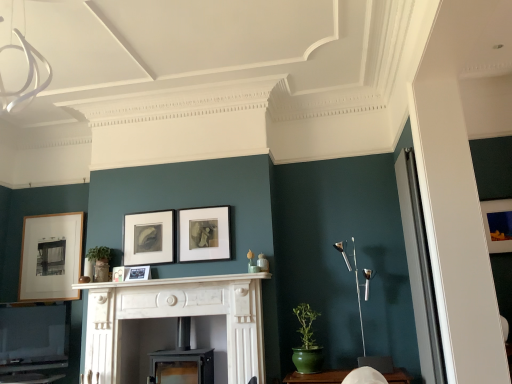
Question: From the image's perspective, would you say matte black picture frame at center, which is counted as the second picture frame, starting from the left, is shown under wooden picture frame at left, the 6th picture frame from the right?

Choices:
 (A) yes
 (B) no

Answer: (A)

Question: Are matte black picture frame at center, which is counted as the second picture frame, starting from the left, and wooden picture frame at left, positioned as the first picture frame in left-to-right order, located far from each other?

Choices:
 (A) yes
 (B) no

Answer: (A)

Question: Is matte black picture frame at center, which is counted as the second picture frame, starting from the left, bigger than wooden picture frame at left, the 6th picture frame from the right?

Choices:
 (A) yes
 (B) no

Answer: (B)

Question: Is matte black picture frame at center, the 5th picture frame viewed from the right, touching wooden picture frame at left, the 6th picture frame from the right?

Choices:
 (A) no
 (B) yes

Answer: (A)

Question: Can you confirm if matte black picture frame at center, which is counted as the second picture frame, starting from the left, is smaller than wooden picture frame at left, the 6th picture frame from the right?

Choices:
 (A) yes
 (B) no

Answer: (A)

Question: From a real-world perspective, relative to wooden picture frame at left, positioned as the first picture frame in left-to-right order, is silver metallic floor lamp at right vertically above or below?

Choices:
 (A) below
 (B) above

Answer: (A)

Question: Considering the positions of silver metallic floor lamp at right and wooden picture frame at left, the 6th picture frame from the right, in the image, is silver metallic floor lamp at right taller or shorter than wooden picture frame at left, the 6th picture frame from the right,?

Choices:
 (A) short
 (B) tall

Answer: (B)

Question: Looking at the image, does silver metallic floor lamp at right seem bigger or smaller compared to wooden picture frame at left, positioned as the first picture frame in left-to-right order?

Choices:
 (A) big
 (B) small

Answer: (A)

Question: From the image's perspective, is silver metallic floor lamp at right positioned above or below wooden picture frame at left, the 6th picture frame from the right?

Choices:
 (A) above
 (B) below

Answer: (B)

Question: Looking at their shapes, would you say black matte picture frame at center, the fifth picture frame when ordered from left to right, is wider or thinner than silver metallic floor lamp at right?

Choices:
 (A) wide
 (B) thin

Answer: (B)

Question: Do you think black matte picture frame at center, placed as the 2th picture frame when sorted from right to left, is within silver metallic floor lamp at right, or outside of it?

Choices:
 (A) outside
 (B) inside

Answer: (A)

Question: Considering their positions, is black matte picture frame at center, placed as the 2th picture frame when sorted from right to left, located in front of or behind silver metallic floor lamp at right?

Choices:
 (A) front
 (B) behind

Answer: (B)

Question: Is black matte picture frame at center, placed as the 2th picture frame when sorted from right to left, bigger or smaller than silver metallic floor lamp at right?

Choices:
 (A) small
 (B) big

Answer: (A)

Question: From a real-world perspective, is matte wooden picture frame at right, placed as the 6th picture frame when sorted from left to right, physically located above or below matte black picture frame at center, the fourth picture frame positioned from the right?

Choices:
 (A) above
 (B) below

Answer: (A)

Question: Looking at their shapes, would you say matte wooden picture frame at right, the first picture frame when ordered from right to left, is wider or thinner than matte black picture frame at center, the third picture frame viewed from the left?

Choices:
 (A) thin
 (B) wide

Answer: (A)